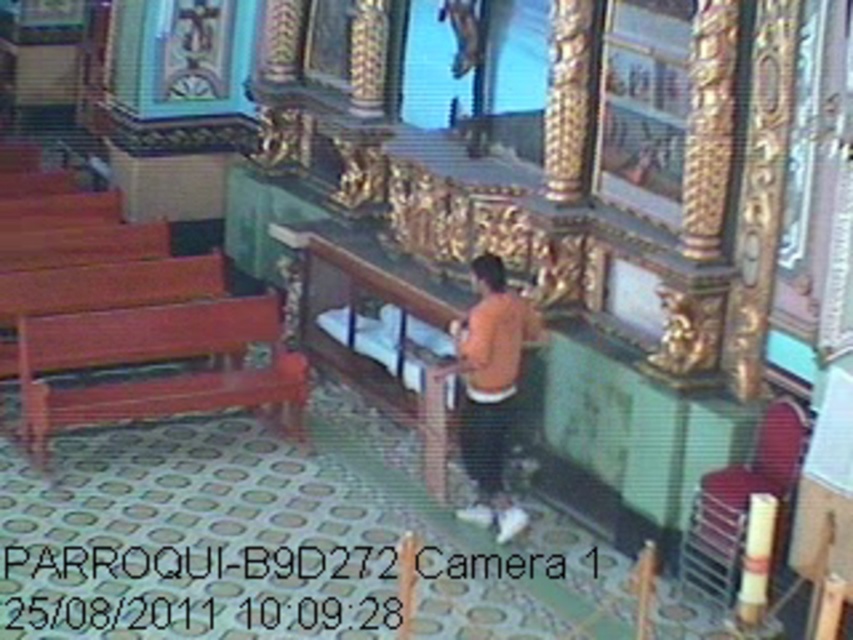
You are a visitor in a church and want to sit down. You see a wooden polished bench at left and an orange matte shirt at center. Which object is closer to the entrance of the church?

The wooden polished bench at left is closer to the entrance of the church because it is positioned on the left side of the orange matte shirt at center, which might indicate it is nearer to the entrance based on typical church layouts where benches are arranged facing the altar.